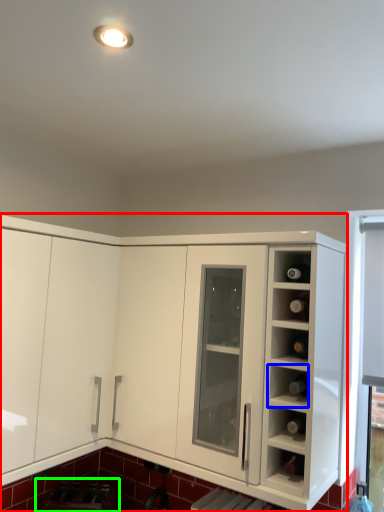
Question: Which object is the farthest from cabinetry (highlighted by a red box)? Choose among these: shelf (highlighted by a blue box) or appliance (highlighted by a green box).

Choices:
 (A) shelf
 (B) appliance

Answer: (B)